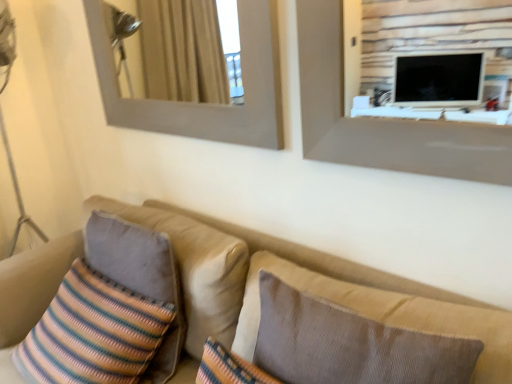
Question: Is beige fabric couch at lower left positioned with its back to striped fabric pillow at left, placed as the second pillow when sorted from right to left?

Choices:
 (A) yes
 (B) no

Answer: (A)

Question: From a real-world perspective, is beige fabric couch at lower left located beneath striped fabric pillow at left, positioned as the 1th pillow in back-to-front order?

Choices:
 (A) no
 (B) yes

Answer: (B)

Question: Is beige fabric couch at lower left positioned beyond the bounds of striped fabric pillow at left, which is the 1th pillow in left-to-right order?

Choices:
 (A) yes
 (B) no

Answer: (A)

Question: From the image's perspective, does beige fabric couch at lower left appear lower than striped fabric pillow at left, which is the 1th pillow in left-to-right order?

Choices:
 (A) no
 (B) yes

Answer: (B)

Question: Is beige fabric couch at lower left oriented towards striped fabric pillow at left, placed as the second pillow when sorted from front to back?

Choices:
 (A) yes
 (B) no

Answer: (A)

Question: From their relative heights in the image, would you say beige fabric couch at lower left is taller or shorter than wooden frame at upper left?

Choices:
 (A) short
 (B) tall

Answer: (B)

Question: Is beige fabric couch at lower left inside or outside of wooden frame at upper left?

Choices:
 (A) inside
 (B) outside

Answer: (B)

Question: Is beige fabric couch at lower left to the left or to the right of wooden frame at upper left in the image?

Choices:
 (A) right
 (B) left

Answer: (A)

Question: Looking at their shapes, would you say beige fabric couch at lower left is wider or thinner than wooden frame at upper left?

Choices:
 (A) wide
 (B) thin

Answer: (A)

Question: From the image's perspective, is wooden frame at upper left positioned above or below striped fabric pillow at left, placed as the second pillow when sorted from front to back?

Choices:
 (A) below
 (B) above

Answer: (B)

Question: Considering the positions of wooden frame at upper left and striped fabric pillow at left, placed as the second pillow when sorted from front to back, in the image, is wooden frame at upper left wider or thinner than striped fabric pillow at left, placed as the second pillow when sorted from front to back,?

Choices:
 (A) thin
 (B) wide

Answer: (A)

Question: Considering the positions of wooden frame at upper left and striped fabric pillow at left, positioned as the 1th pillow in back-to-front order, in the image, is wooden frame at upper left taller or shorter than striped fabric pillow at left, positioned as the 1th pillow in back-to-front order,?

Choices:
 (A) short
 (B) tall

Answer: (B)

Question: Considering their positions, is wooden frame at upper left located in front of or behind striped fabric pillow at left, placed as the second pillow when sorted from front to back?

Choices:
 (A) behind
 (B) front

Answer: (B)

Question: From a real-world perspective, is brown textured pillow at center, the second pillow when ordered from left to right, positioned above or below striped fabric pillow at left, which is the 1th pillow in left-to-right order?

Choices:
 (A) below
 (B) above

Answer: (B)

Question: Looking at their shapes, would you say brown textured pillow at center, which appears as the second pillow when viewed from the back, is wider or thinner than striped fabric pillow at left, positioned as the 1th pillow in back-to-front order?

Choices:
 (A) wide
 (B) thin

Answer: (A)